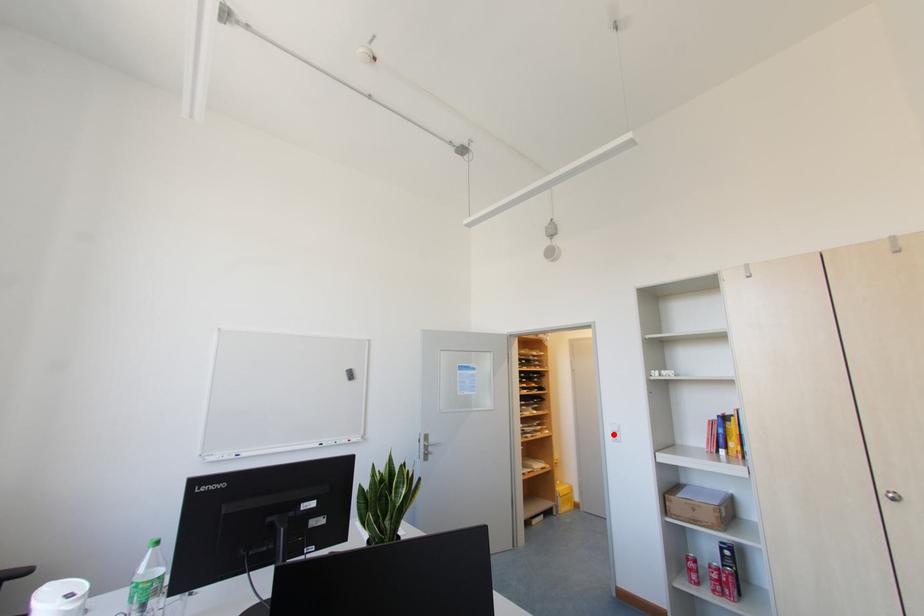
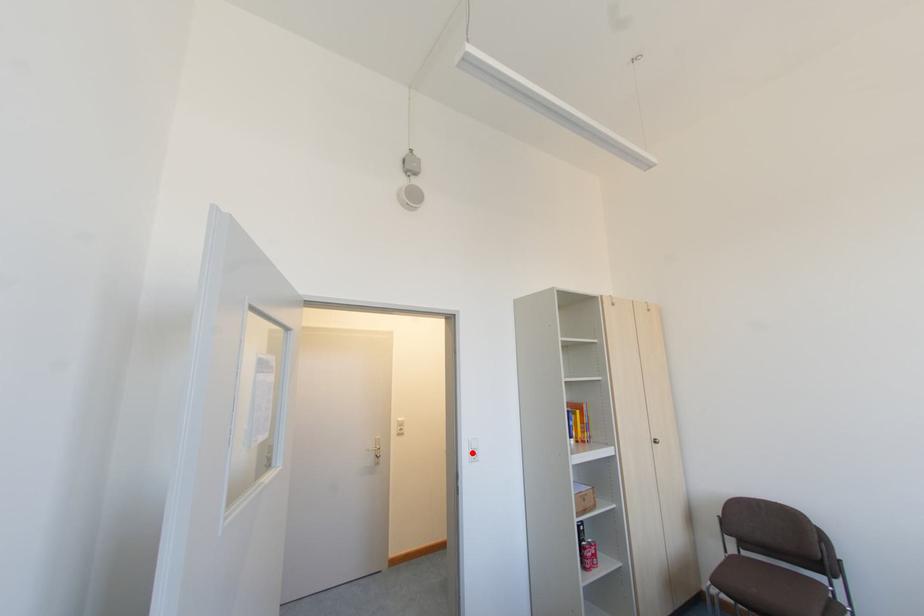
I am providing you with two images of the same scene from different viewpoints. A red point is marked on the first image and another point is marked on the second image. Is the marked point in image1 the same physical position as the marked point in image2?

Yes